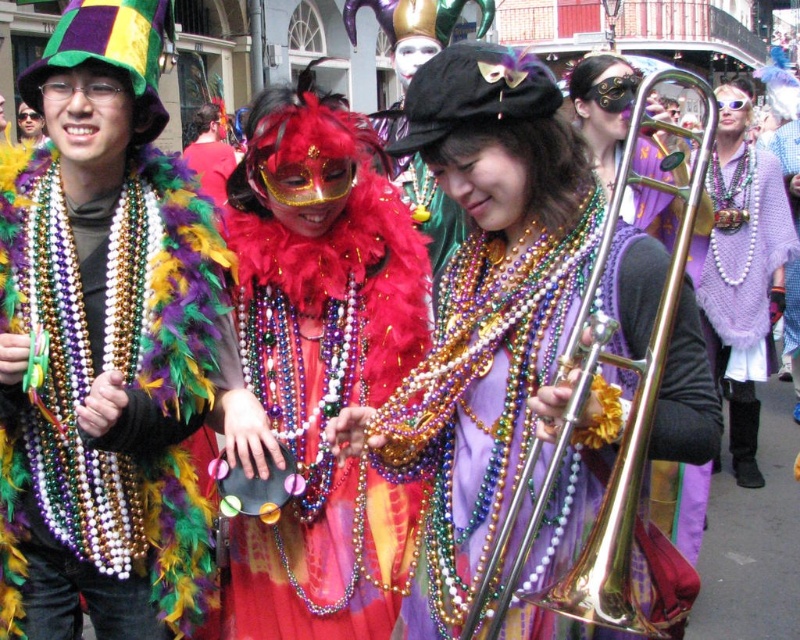
Question: Which point is farther to the camera?

Choices:
 (A) feather boa at center
 (B) shiny gold trombone at center

Answer: (A)

Question: Does feather boa at center appear on the right side of matte black hat at center?

Choices:
 (A) yes
 (B) no

Answer: (A)

Question: Does matte black hat at upper left appear over feather boa at center?

Choices:
 (A) yes
 (B) no

Answer: (A)

Question: Among these objects, which one is farthest from the camera?

Choices:
 (A) feather boa at center
 (B) pearl knitted shawl at right
 (C) shiny gold trombone at center
 (D) matte black hat at center

Answer: (D)

Question: Is pearl knitted shawl at right to the right of matte black hat at center from the viewer's perspective?

Choices:
 (A) no
 (B) yes

Answer: (B)

Question: Estimate the real-world distances between objects in this image. Which object is farther from the feather boa at center?

Choices:
 (A) pearl knitted shawl at right
 (B) matte black hat at upper left

Answer: (A)